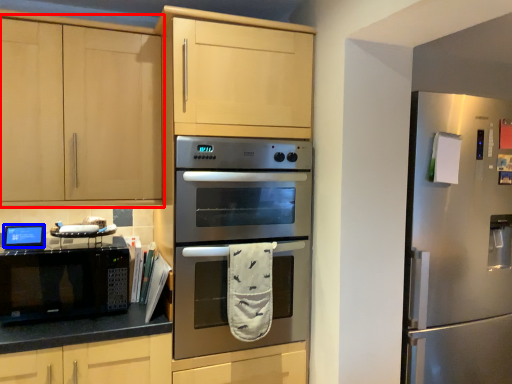
Question: Which of the following is the closest to the observer, cabinetry (highlighted by a red box) or appliance (highlighted by a blue box)?

Choices:
 (A) cabinetry
 (B) appliance

Answer: (A)